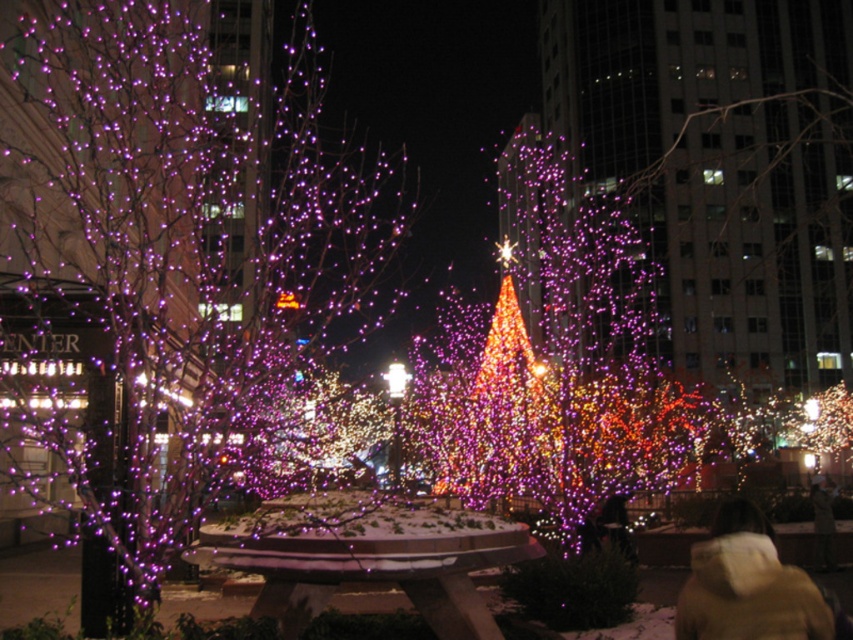
Is tan quilted jacket at lower right taller than illuminated glass christmas tree at center?

Incorrect, tan quilted jacket at lower right's height is not larger of illuminated glass christmas tree at center's.

Based on the photo, which of these two, tan quilted jacket at lower right or illuminated glass christmas tree at center, stands taller?

Standing taller between the two is illuminated glass christmas tree at center.

Describe the element at coordinates (747, 586) in the screenshot. I see `tan quilted jacket at lower right` at that location.

This screenshot has width=853, height=640. In order to click on tan quilted jacket at lower right in this screenshot , I will do `click(747, 586)`.

Is purple glossy tree at center wider than tan quilted jacket at lower right?

Indeed, purple glossy tree at center has a greater width compared to tan quilted jacket at lower right.

This screenshot has width=853, height=640. What do you see at coordinates (184, 241) in the screenshot?
I see `purple glossy tree at center` at bounding box center [184, 241].

Identify the location of purple glossy tree at center. The image size is (853, 640). (184, 241).

Is purple glossy tree at center further to the viewer compared to illuminated glass christmas tree at center?

No.

Who is lower down, purple glossy tree at center or illuminated glass christmas tree at center?

Positioned lower is illuminated glass christmas tree at center.

Measure the distance between purple glossy tree at center and camera.

purple glossy tree at center and camera are 59.02 feet apart.

Where is `purple glossy tree at center`? Image resolution: width=853 pixels, height=640 pixels. purple glossy tree at center is located at coordinates (184, 241).